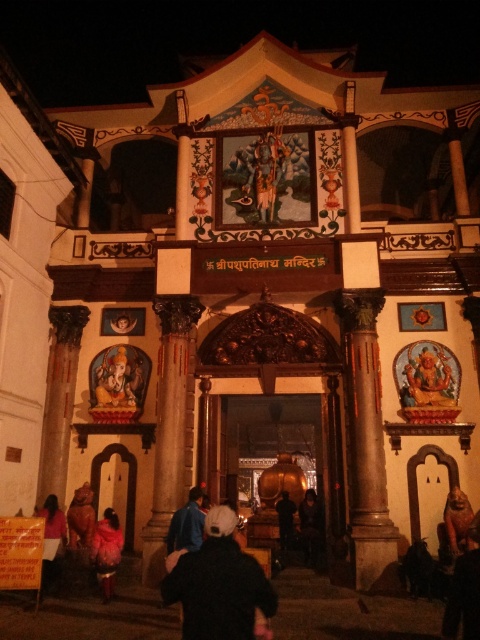
You are standing at the entrance of the temple and want to place a 20 meter long decorative banner between the matte golden statue at lower left and the dark blue fabric at center. Is there enough space?

The distance between the matte golden statue at lower left and the dark blue fabric at center is 21.10 meters, so yes, the 20 meter long decorative banner can be placed between them as there is sufficient space.

You are a visitor standing in front of the temple entrance at night. You see the black fabric at center and the golden statue at center. Which object is closer to you?

The black fabric at center is positioned under the golden statue at center, so the golden statue at center is closer to you.

Looking at this image, you are standing at the entrance of the temple and want to take a photo of the grand archway. If you are currently at a point located at coordinates point [145,387], which is 53.11 meters away from the archway, can you capture the entire archway in your camera frame without moving closer?

The point [145,387] is 53.11 meters away from the camera. Since the archway is the central feature and the distance is quite far, it is likely that you can capture the entire archway in your camera frame without moving closer, assuming your camera has a wide enough lens.